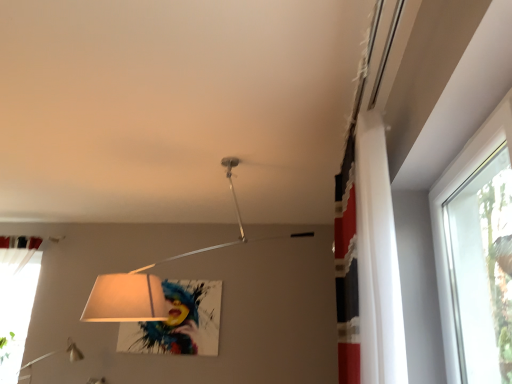
Question: Considering the positions of matte white lampshade at center and transparent glass window at upper right in the image, is matte white lampshade at center wider or thinner than transparent glass window at upper right?

Choices:
 (A) wide
 (B) thin

Answer: (A)

Question: Considering the positions of matte white lampshade at center and transparent glass window at upper right in the image, is matte white lampshade at center bigger or smaller than transparent glass window at upper right?

Choices:
 (A) small
 (B) big

Answer: (B)

Question: Which is farther from the transparent glass window at upper right?

Choices:
 (A) white fabric curtain at upper right, placed as the second curtain when sorted from back to front
 (B) white sheer curtain at lower left, the first curtain in the left-to-right sequence
 (C) matte white lampshade at center

Answer: (B)

Question: Considering the real-world distances, which object is closest to the transparent glass window at upper right?

Choices:
 (A) white sheer curtain at lower left, the first curtain in the left-to-right sequence
 (B) matte white lampshade at center
 (C) white fabric curtain at upper right, which appears as the second curtain when viewed from the left

Answer: (C)